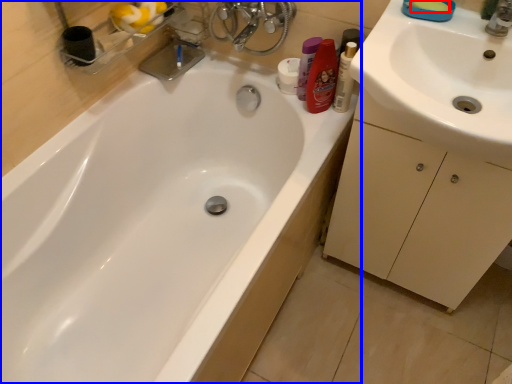
Question: Which of the following is the closest to the observer, soap (highlighted by a red box) or bathtub (highlighted by a blue box)?

Choices:
 (A) soap
 (B) bathtub

Answer: (B)